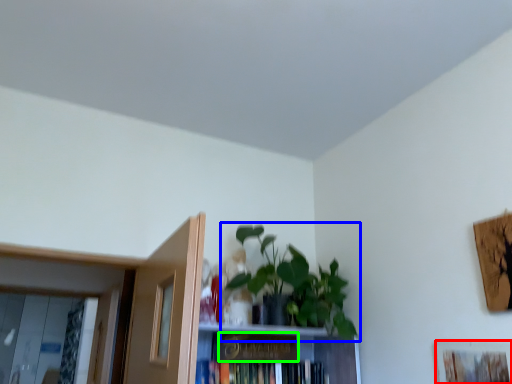
Question: Considering the real-world distances, which object is closest to picture frame (highlighted by a red box)? houseplant (highlighted by a blue box) or paperback book (highlighted by a green box).

Choices:
 (A) houseplant
 (B) paperback book

Answer: (A)